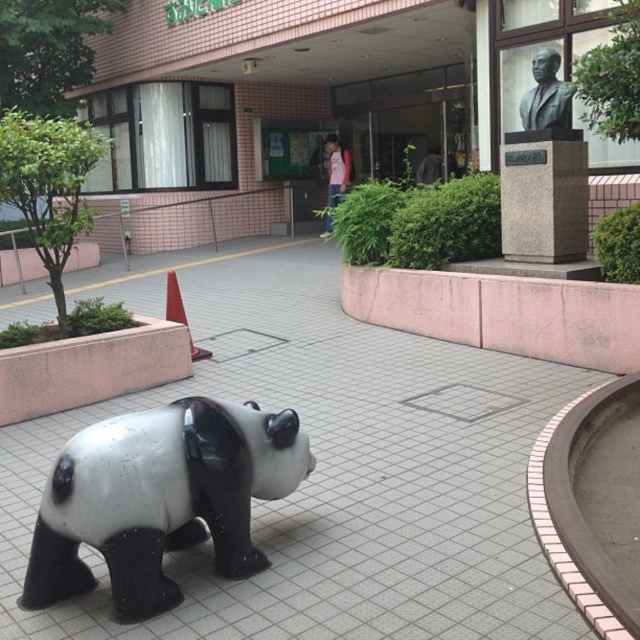
You are a delivery person trying to park your 1.2 meter wide cart between the white glossy pavement at center and the black and white glossy panda at center. Can your cart fit there?

The white glossy pavement at center is thinner than the black and white glossy panda at center. Since the pavement is thinner, it might not provide enough space for the cart. However, the description only mentions their widths relative to each other, not absolute measurements. Without knowing the exact width of the pavement, it is uncertain if the 1.2 meter cart can fit. Please check the actual space before attempting to park.

You are standing in front of the building and want to walk towards the statue of the panda bear. Which point, point (141, 637) or point (291, 467), is closer to you as you approach the statue?

Point (141, 637) is closer to the viewer than point (291, 467), so it would be the closer point as you approach the statue.